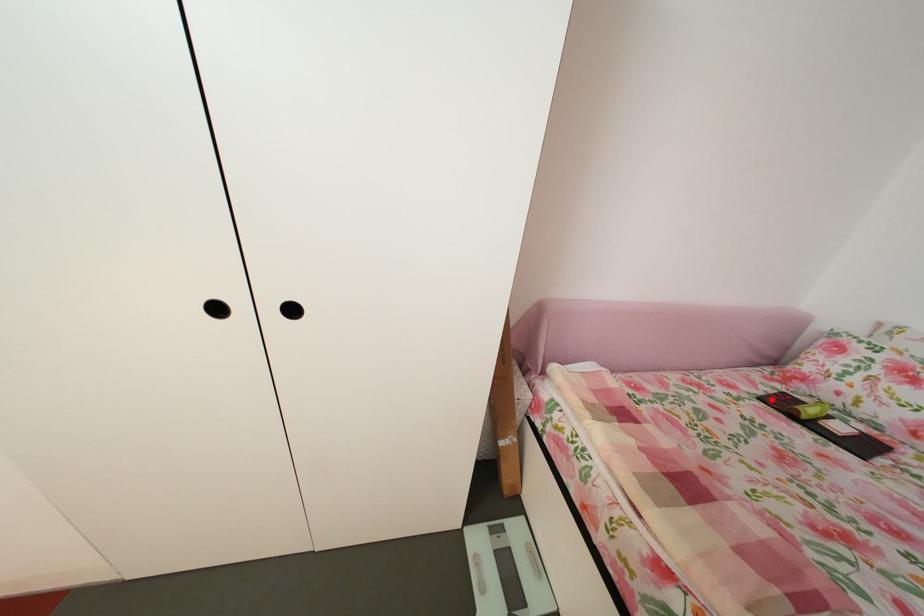
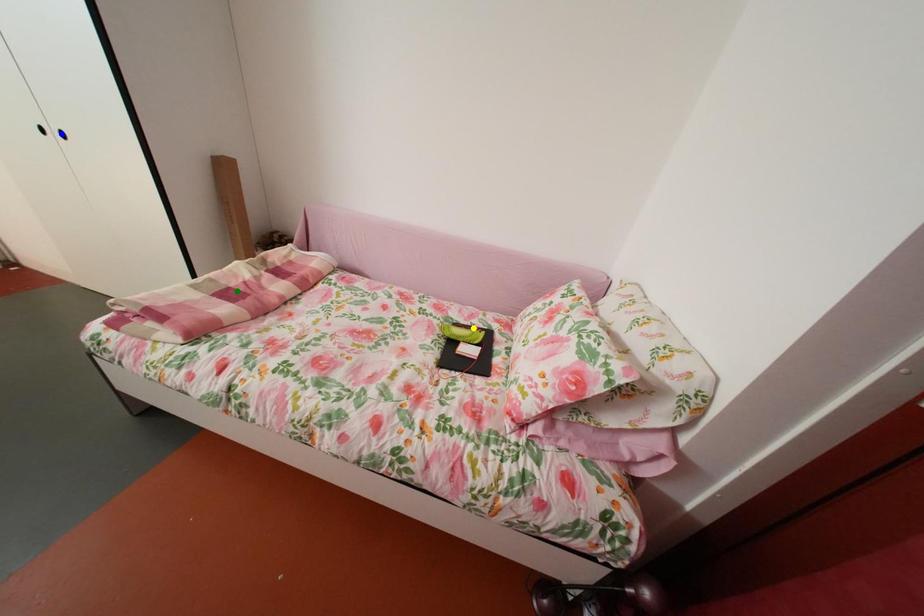
Question: I am providing you with two images of the same scene from different viewpoints. A red point is marked on the first image. You are given multiple points on the second image. Which point in image 2 represents the same 3d spot as the red point in image 1?

Choices:
 (A) yellow point
 (B) green point
 (C) blue point

Answer: (A)